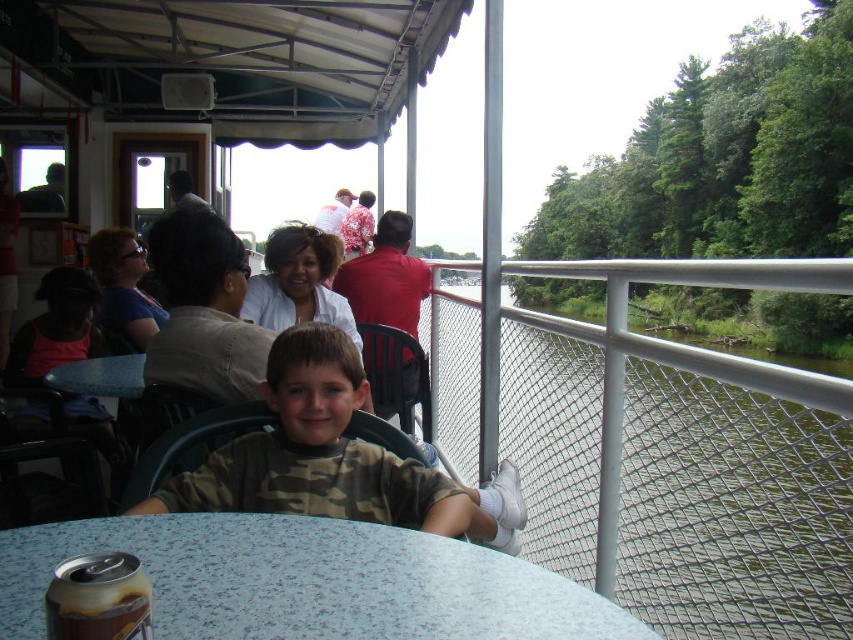
Is point (469, 512) farther from camera compared to point (83, 390)?

No, (469, 512) is in front of (83, 390).

The width and height of the screenshot is (853, 640). Identify the location of camouflage fabric shirt at center. (335, 458).

Is metallic silver soda can at lower left positioned in front of blue fabric table at lower center?

Yes.

Can you confirm if metallic silver soda can at lower left is positioned to the left of blue fabric table at lower center?

No, metallic silver soda can at lower left is not to the left of blue fabric table at lower center.

Who is more distant from viewer, (112, 593) or (90, 392)?

Point (90, 392)

At what (x,y) coordinates should I click in order to perform the action: click on metallic silver soda can at lower left. Please return your answer as a coordinate pair (x, y). Looking at the image, I should click on (97, 598).

Which is below, speckled plastic table at lower center or blue fabric table at lower center?

Positioned lower is speckled plastic table at lower center.

How much distance is there between speckled plastic table at lower center and blue fabric table at lower center?

speckled plastic table at lower center is 5.62 feet away from blue fabric table at lower center.

Where is `speckled plastic table at lower center`? The height and width of the screenshot is (640, 853). speckled plastic table at lower center is located at coordinates (309, 580).

This screenshot has width=853, height=640. I want to click on speckled plastic table at lower center, so click(309, 580).